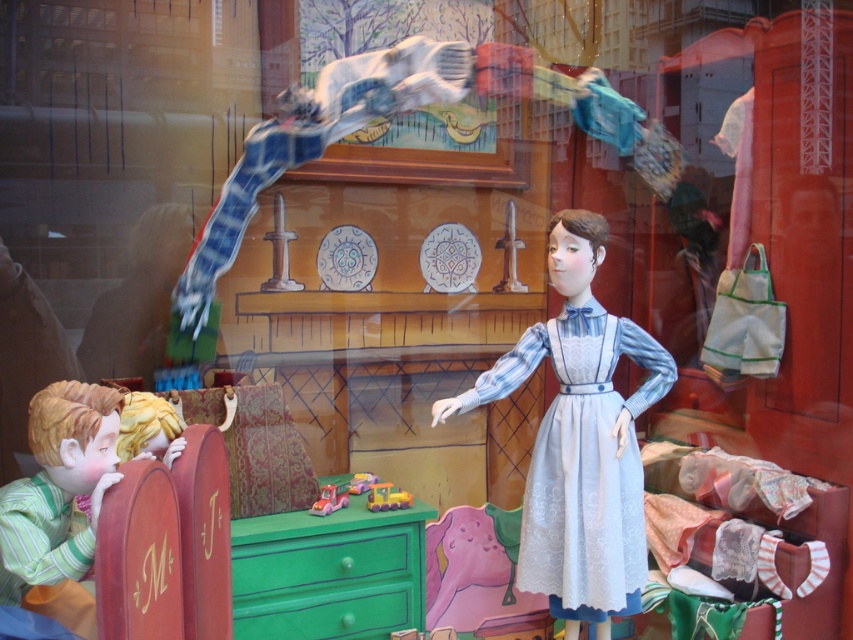
Question: Among these objects, which one is farthest from the camera?

Choices:
 (A) yellow rubber toy car at center
 (B) green painted wood drawer at lower center

Answer: (A)

Question: Can you confirm if green striped fabric at left is positioned to the left of rubber yellow car at center?

Choices:
 (A) yes
 (B) no

Answer: (A)

Question: Considering the real-world distances, which object is closest to the green painted wood drawer at center?

Choices:
 (A) yellow rubber toy car at center
 (B) light blue lace dress at center

Answer: (A)

Question: Estimate the real-world distances between objects in this image. Which object is farther from the green striped fabric at left?

Choices:
 (A) light blue lace dress at center
 (B) yellow rubber toy car at center
 (C) rubber yellow car at center
 (D) green painted wood drawer at center

Answer: (C)

Question: Is green striped fabric at left to the right of green painted wood drawer at center from the viewer's perspective?

Choices:
 (A) no
 (B) yes

Answer: (A)

Question: Considering the relative positions of pastel plastic toy car at center and yellow rubber toy car at center in the image provided, where is pastel plastic toy car at center located with respect to yellow rubber toy car at center?

Choices:
 (A) right
 (B) left

Answer: (B)